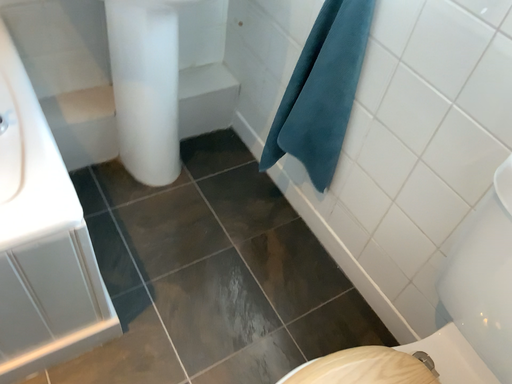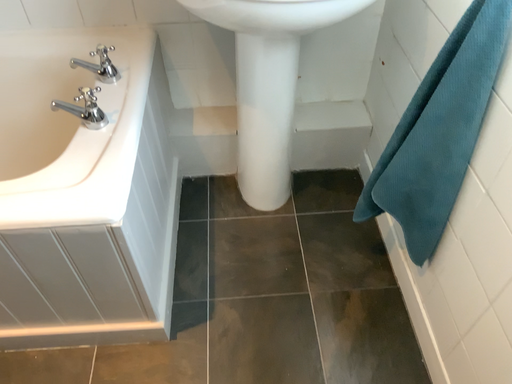
Question: Which way did the camera rotate in the video?

Choices:
 (A) rotated upward
 (B) rotated downward

Answer: (A)